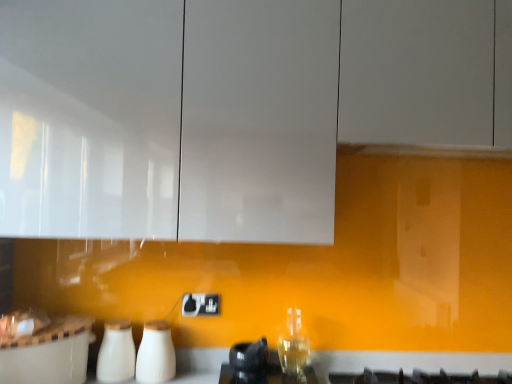
Question: Are black plastic electric outlet at center and white glossy milk bottles at lower center, the 1th appliance positioned from the left, beside each other?

Choices:
 (A) no
 (B) yes

Answer: (A)

Question: Can you confirm if black plastic electric outlet at center is taller than white glossy milk bottles at lower center, the 1th appliance positioned from the left?

Choices:
 (A) no
 (B) yes

Answer: (A)

Question: Is black plastic electric outlet at center outside white glossy milk bottles at lower center, the 1th appliance positioned from the left?

Choices:
 (A) yes
 (B) no

Answer: (A)

Question: Can you confirm if black plastic electric outlet at center is wider than white glossy milk bottles at lower center, the 1th appliance positioned from the left?

Choices:
 (A) yes
 (B) no

Answer: (B)

Question: From a real-world perspective, is black plastic electric outlet at center beneath white glossy milk bottles at lower center, which is counted as the second appliance, starting from the right?

Choices:
 (A) no
 (B) yes

Answer: (A)

Question: Does black plastic electric outlet at center lie behind white glossy milk bottles at lower center, the 1th appliance positioned from the left?

Choices:
 (A) no
 (B) yes

Answer: (B)

Question: Is white glossy milk bottles at lower center, which is counted as the second appliance, starting from the right, positioned far away from white glossy countertop at lower center?

Choices:
 (A) yes
 (B) no

Answer: (B)

Question: Can you confirm if white glossy milk bottles at lower center, which is counted as the second appliance, starting from the right, is positioned to the right of white glossy countertop at lower center?

Choices:
 (A) no
 (B) yes

Answer: (A)

Question: Does white glossy milk bottles at lower center, which is counted as the second appliance, starting from the right, come behind white glossy countertop at lower center?

Choices:
 (A) yes
 (B) no

Answer: (B)

Question: Does white glossy milk bottles at lower center, which is counted as the second appliance, starting from the right, have a greater height compared to white glossy countertop at lower center?

Choices:
 (A) yes
 (B) no

Answer: (A)

Question: Are white glossy milk bottles at lower center, which is counted as the second appliance, starting from the right, and white glossy countertop at lower center making contact?

Choices:
 (A) no
 (B) yes

Answer: (A)

Question: From a real-world perspective, does white glossy milk bottles at lower center, the 1th appliance positioned from the left, stand above white glossy countertop at lower center?

Choices:
 (A) no
 (B) yes

Answer: (B)

Question: Is white glossy cabinet at upper center located within white glossy milk bottles at lower center, which is counted as the second appliance, starting from the right?

Choices:
 (A) yes
 (B) no

Answer: (B)